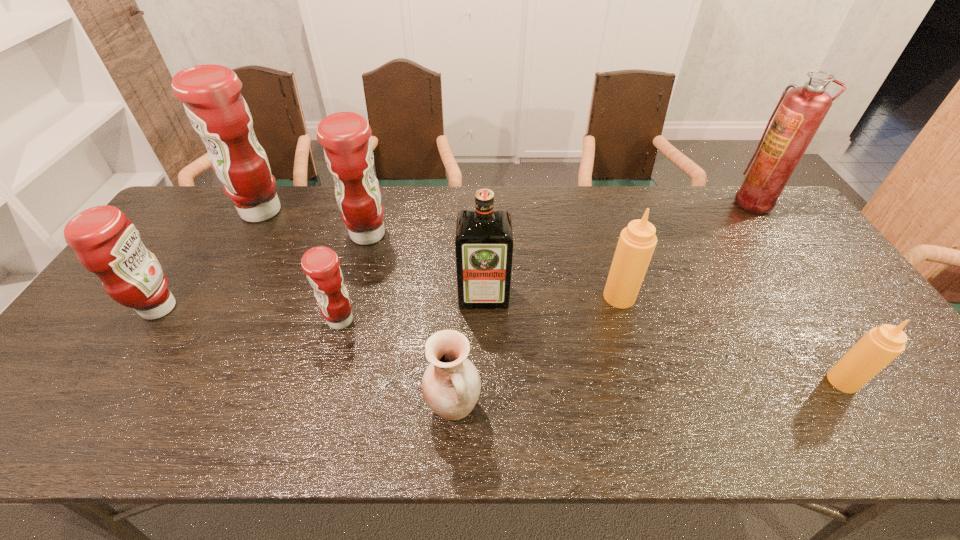
Locate an element on the screen. The width and height of the screenshot is (960, 540). vacant space situated 0.220m on the left of the smallest red condiment is located at coordinates (239, 320).

Where is `vacant space located 0.380m on the left of the pink pottery`? vacant space located 0.380m on the left of the pink pottery is located at coordinates (255, 407).

I want to click on fire extinguisher located at the far edge, so click(801, 110).

Locate an element on the screen. object that is at the near edge is located at coordinates (451, 384).

Image resolution: width=960 pixels, height=540 pixels. What are the coordinates of `object situated at the left edge` in the screenshot? It's located at (106, 243).

This screenshot has width=960, height=540. I want to click on fire extinguisher that is at the right edge, so click(x=801, y=110).

This screenshot has height=540, width=960. In order to click on condiment that is at the right edge in this screenshot , I will do coord(881,345).

The height and width of the screenshot is (540, 960). In order to click on object located in the far right corner section of the desktop in this screenshot , I will do `click(801, 110)`.

Where is `vacant space at the far edge of the desktop`? Image resolution: width=960 pixels, height=540 pixels. vacant space at the far edge of the desktop is located at coordinates (311, 220).

This screenshot has width=960, height=540. In the image, there is a desktop. In order to click on free space at the near edge in this screenshot , I will do `click(197, 439)`.